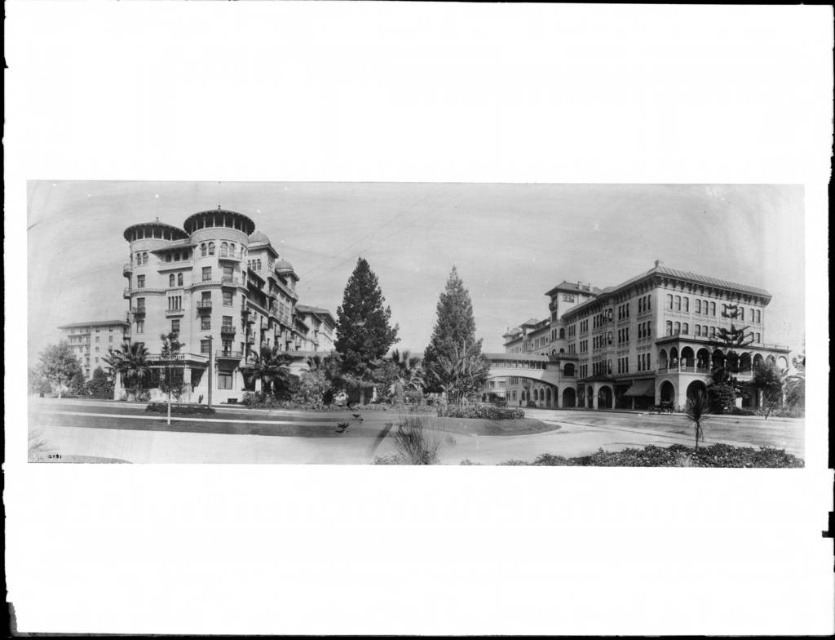
You are standing in the middle of the hotel complex and want to take a photo of both the smooth white building at left and the smooth tan building at center. Which building should you position yourself closer to in order to capture both in the same frame?

You should position yourself closer to the smooth tan building at center because the smooth white building at left is to the left of the smooth tan building at center, so moving closer to the central building will help include both in the frame.